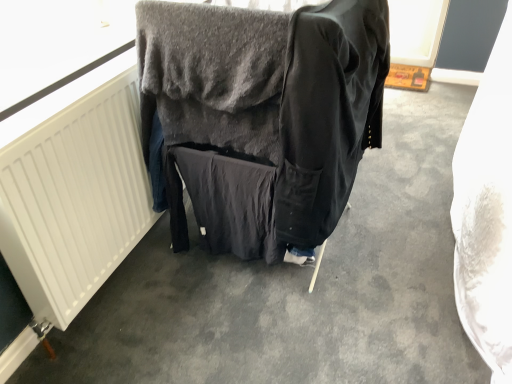
In order to face dark gray fabric at center, should I rotate leftwards or rightwards?

To align with it, rotate right about 1.291°.

Where is `dark gray fabric at center`? This screenshot has width=512, height=384. dark gray fabric at center is located at coordinates (262, 117).

Is black cotton jacket at center at the back of dark gray fabric at center?

Yes, black cotton jacket at center is at the back of dark gray fabric at center.

From the image's perspective, between dark gray fabric at center and black cotton jacket at center, which one is located above?

black cotton jacket at center, from the image's perspective.

Does dark gray fabric at center have a lesser width compared to black cotton jacket at center?

No, dark gray fabric at center is not thinner than black cotton jacket at center.

Is dark gray fabric at center smaller than black cotton jacket at center?

No, dark gray fabric at center is not smaller than black cotton jacket at center.

Looking at this image, in terms of width, does white matte radiator at left look wider or thinner when compared to dark gray fabric at center?

Clearly, white matte radiator at left has less width compared to dark gray fabric at center.

From the image's perspective, is white matte radiator at left above or below dark gray fabric at center?

Clearly, from the image's perspective, white matte radiator at left is below dark gray fabric at center.

Is the surface of white matte radiator at left in direct contact with dark gray fabric at center?

No, white matte radiator at left is not beside dark gray fabric at center.

Considering the sizes of objects dark gray fabric at center and white matte radiator at left in the image provided, who is taller, dark gray fabric at center or white matte radiator at left?

Standing taller between the two is dark gray fabric at center.

Considering the sizes of objects dark gray fabric at center and white matte radiator at left in the image provided, who is wider, dark gray fabric at center or white matte radiator at left?

Wider between the two is dark gray fabric at center.

Is dark gray fabric at center not near white matte radiator at left?

No, there isn't a large distance between dark gray fabric at center and white matte radiator at left.

Does black cotton jacket at center have a greater height compared to dark gray fabric at center?

Incorrect, the height of black cotton jacket at center is not larger of that of dark gray fabric at center.

Can dark gray fabric at center be found inside black cotton jacket at center?

Actually, dark gray fabric at center is outside black cotton jacket at center.

Based on the photo, between black cotton jacket at center and dark gray fabric at center, which one has smaller width?

Thinner between the two is black cotton jacket at center.

From a real-world perspective, is black cotton jacket at center positioned above or below dark gray fabric at center?

In terms of real-world spatial position, black cotton jacket at center is above dark gray fabric at center.

Based on the photo, considering the sizes of black cotton jacket at center and white matte radiator at left in the image, is black cotton jacket at center wider or thinner than white matte radiator at left?

black cotton jacket at center is wider than white matte radiator at left.

Which is more to the right, black cotton jacket at center or white matte radiator at left?

black cotton jacket at center.

Does black cotton jacket at center lie behind white matte radiator at left?

No, it is in front of white matte radiator at left.

Is white matte radiator at left at the right side of black cotton jacket at center?

Incorrect, white matte radiator at left is not on the right side of black cotton jacket at center.

Which is less distant, (61, 119) or (291, 118)?

Point (61, 119) is farther from the camera than point (291, 118).

Is the position of white matte radiator at left more distant than that of black cotton jacket at center?

Yes.

Considering the relative sizes of white matte radiator at left and black cotton jacket at center in the image provided, is white matte radiator at left smaller than black cotton jacket at center?

Yes.

The width and height of the screenshot is (512, 384). Identify the location of clothing on the right of dark gray fabric at center. (328, 114).

The height and width of the screenshot is (384, 512). I want to click on radiator in front of the dark gray fabric at center, so click(x=75, y=199).

Estimate the real-world distances between objects in this image. Which object is closer to dark gray fabric at center, black cotton jacket at center or white matte radiator at left?

black cotton jacket at center.

Considering their positions, is dark gray fabric at center positioned closer to white matte radiator at left than black cotton jacket at center?

dark gray fabric at center.

From the image, which object appears to be nearer to dark gray fabric at center, white matte radiator at left or black cotton jacket at center?

black cotton jacket at center.

Considering their positions, is white matte radiator at left positioned closer to black cotton jacket at center than dark gray fabric at center?

Among the two, dark gray fabric at center is located nearer to black cotton jacket at center.

From the image, which object appears to be nearer to white matte radiator at left, black cotton jacket at center or dark gray fabric at center?

dark gray fabric at center lies closer to white matte radiator at left than the other object.

Which object lies nearer to the anchor point black cotton jacket at center, dark gray fabric at center or white matte radiator at left?

Based on the image, dark gray fabric at center appears to be nearer to black cotton jacket at center.

The width and height of the screenshot is (512, 384). What are the coordinates of `furniture between white matte radiator at left and black cotton jacket at center from left to right` in the screenshot? It's located at (262, 117).